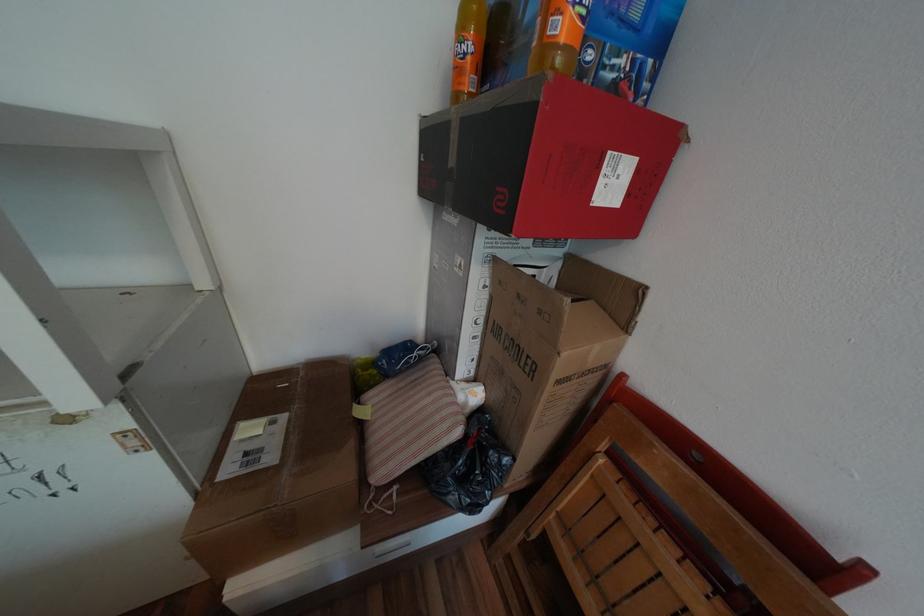
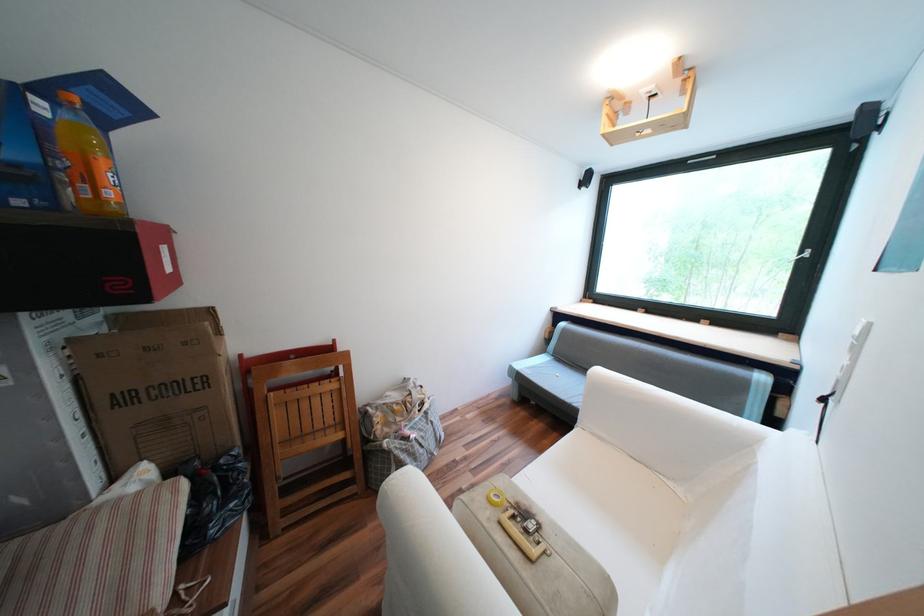
Locate, in the second image, the point that corresponds to (x=569, y=26) in the first image.

(118, 193)